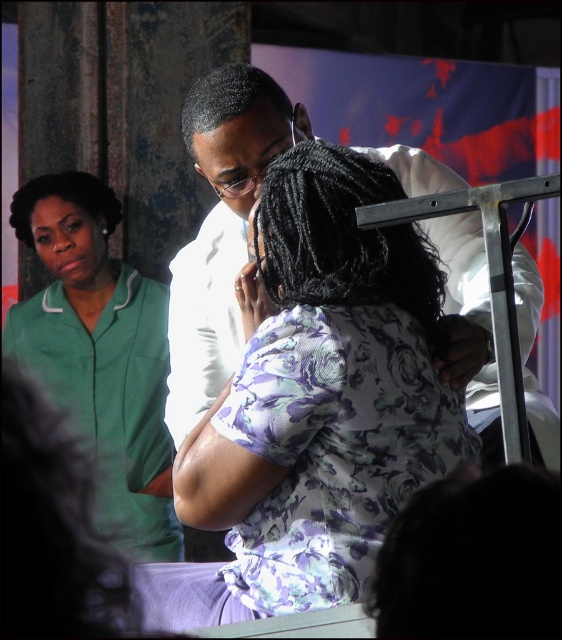
Is floral fabric blouse at center thinner than white smooth shirt at center?

Yes.

Is floral fabric blouse at center further to the viewer compared to white smooth shirt at center?

No, floral fabric blouse at center is in front of white smooth shirt at center.

Does point (291, 566) come closer to viewer compared to point (219, 362)?

Yes.

Locate an element on the screen. floral fabric blouse at center is located at coordinates (315, 404).

In the scene shown: Between floral fabric blouse at center and green uniform at left, which one has less height?

Standing shorter between the two is floral fabric blouse at center.

Is floral fabric blouse at center shorter than green uniform at left?

Yes.

Which is in front, point (373, 196) or point (83, 212)?

Positioned in front is point (373, 196).

You are a GUI agent. You are given a task and a screenshot of the screen. Output one action in this format:
    pyautogui.click(x=<x>, y=<y>)
    Task: Click on the floral fabric blouse at center
    This screenshot has height=640, width=562.
    Given the screenshot: What is the action you would take?
    pyautogui.click(x=315, y=404)

Can you confirm if white smooth shirt at center is smaller than green uniform at left?

Incorrect, white smooth shirt at center is not smaller in size than green uniform at left.

Is white smooth shirt at center taller than green uniform at left?

Incorrect, white smooth shirt at center's height is not larger of green uniform at left's.

Where is `white smooth shirt at center`? Image resolution: width=562 pixels, height=640 pixels. white smooth shirt at center is located at coordinates (220, 228).